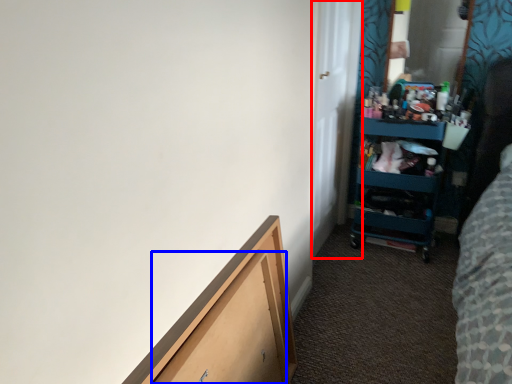
Question: Which object appears closest to the camera in this image, door (highlighted by a red box) or drawer (highlighted by a blue box)?

Choices:
 (A) door
 (B) drawer

Answer: (B)